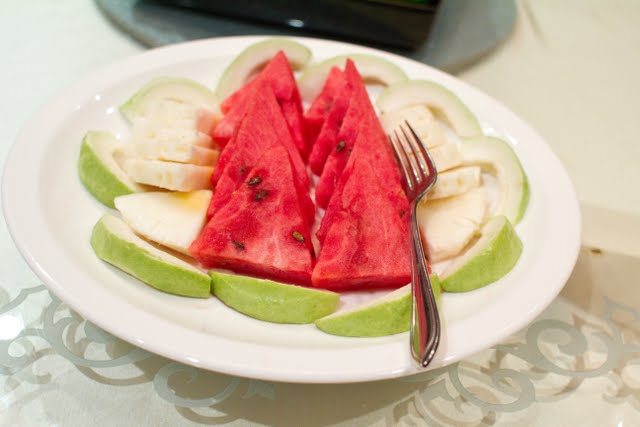
Image resolution: width=640 pixels, height=427 pixels. In order to click on fork in this screenshot , I will do `click(416, 339)`.